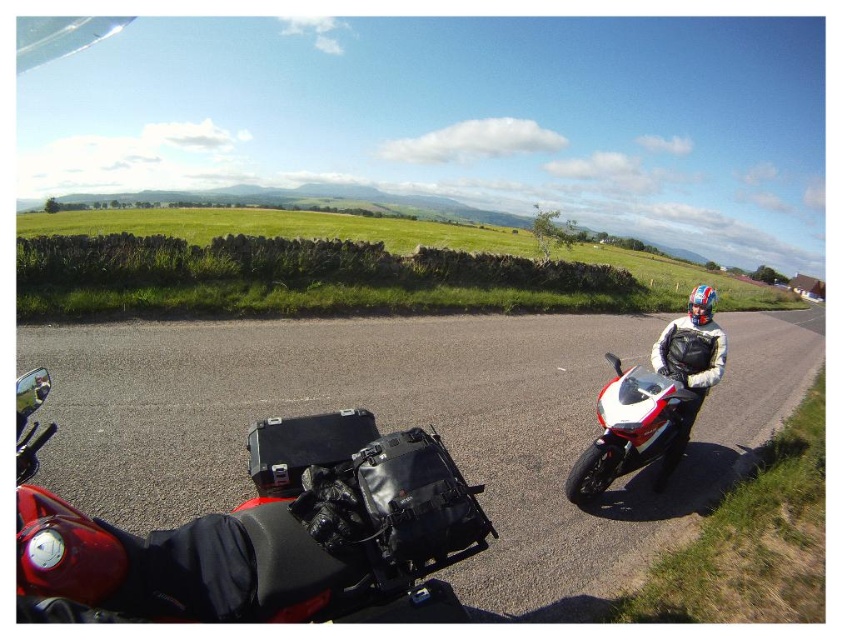
You are a photographer planning to take a photo of the green stone wall at center and the white glossy sportbike at right. Since you want both objects to be clearly visible in the frame, which object should you focus on first to ensure proper depth of field?

The green stone wall at center should be focused on first because it is taller than the white glossy sportbike at right, ensuring that the larger object is in sharp focus while the smaller one still remains visible in the background.

You are standing at the point marked as point (329, 268) on the image. What object is located exactly at that point?

The point (329, 268) corresponds to the green stone wall at center.